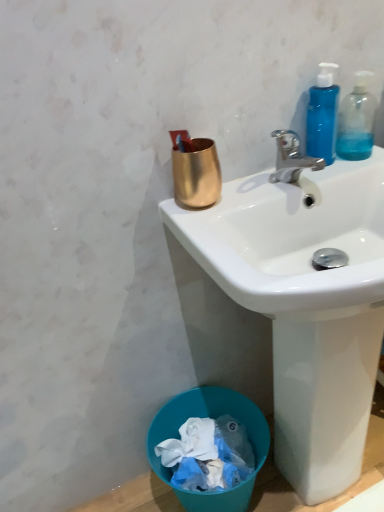
Question: Considering the relative sizes of blue translucent bottle at upper right, the 2th bottle viewed from the right, and gold metallic cup at upper center in the image provided, is blue translucent bottle at upper right, the 2th bottle viewed from the right, bigger than gold metallic cup at upper center?

Choices:
 (A) yes
 (B) no

Answer: (B)

Question: Is blue translucent bottle at upper right, the 2th bottle viewed from the right, not within gold metallic cup at upper center?

Choices:
 (A) yes
 (B) no

Answer: (A)

Question: Is blue translucent bottle at upper right, the 2th bottle viewed from the right, to the left of gold metallic cup at upper center from the viewer's perspective?

Choices:
 (A) yes
 (B) no

Answer: (B)

Question: Is blue translucent bottle at upper right, which is the first bottle in left-to-right order, to the right of gold metallic cup at upper center from the viewer's perspective?

Choices:
 (A) no
 (B) yes

Answer: (B)

Question: Could you tell me if blue translucent bottle at upper right, which is the first bottle in left-to-right order, is turned towards gold metallic cup at upper center?

Choices:
 (A) no
 (B) yes

Answer: (A)

Question: Is point (210, 293) positioned closer to the camera than point (306, 159)?

Choices:
 (A) farther
 (B) closer

Answer: (A)

Question: Would you say white glossy sink at upper center is inside or outside polished chrome faucet at upper right?

Choices:
 (A) outside
 (B) inside

Answer: (A)

Question: Considering the relative positions of white glossy sink at upper center and polished chrome faucet at upper right in the image provided, is white glossy sink at upper center to the left or to the right of polished chrome faucet at upper right?

Choices:
 (A) right
 (B) left

Answer: (A)

Question: In terms of width, does white glossy sink at upper center look wider or thinner when compared to polished chrome faucet at upper right?

Choices:
 (A) thin
 (B) wide

Answer: (B)

Question: From a real-world perspective, is transparent plastic bottle at upper right, placed as the 1th bottle when sorted from right to left, physically located above or below blue plastic trash bin at lower left?

Choices:
 (A) below
 (B) above

Answer: (B)

Question: Is transparent plastic bottle at upper right, the 2th bottle viewed from the left, to the left or to the right of blue plastic trash bin at lower left in the image?

Choices:
 (A) right
 (B) left

Answer: (A)

Question: From the image's perspective, is transparent plastic bottle at upper right, the 2th bottle viewed from the left, above or below blue plastic trash bin at lower left?

Choices:
 (A) above
 (B) below

Answer: (A)

Question: In terms of height, does transparent plastic bottle at upper right, placed as the 1th bottle when sorted from right to left, look taller or shorter compared to blue plastic trash bin at lower left?

Choices:
 (A) short
 (B) tall

Answer: (A)

Question: Is gold metallic cup at upper center bigger or smaller than blue translucent bottle at upper right, which is the first bottle in left-to-right order?

Choices:
 (A) big
 (B) small

Answer: (A)

Question: In terms of height, does gold metallic cup at upper center look taller or shorter compared to blue translucent bottle at upper right, which is the first bottle in left-to-right order?

Choices:
 (A) short
 (B) tall

Answer: (A)